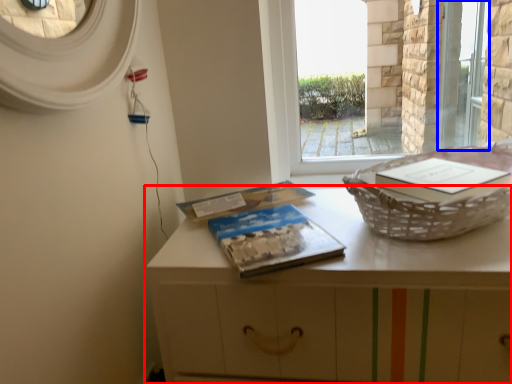
Question: Among these objects, which one is farthest to the camera, table (highlighted by a red box) or screen door (highlighted by a blue box)?

Choices:
 (A) table
 (B) screen door

Answer: (B)